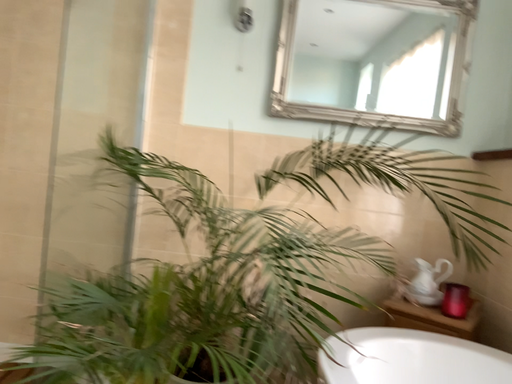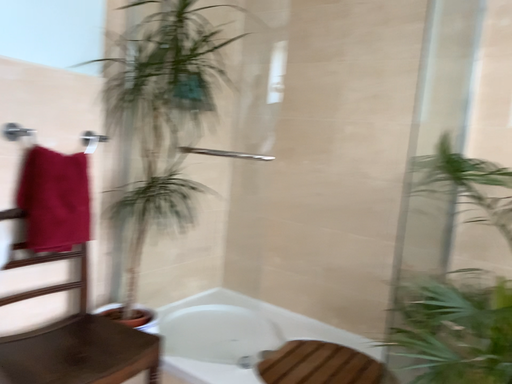
Question: How did the camera likely rotate when shooting the video?

Choices:
 (A) rotated left
 (B) rotated right

Answer: (A)